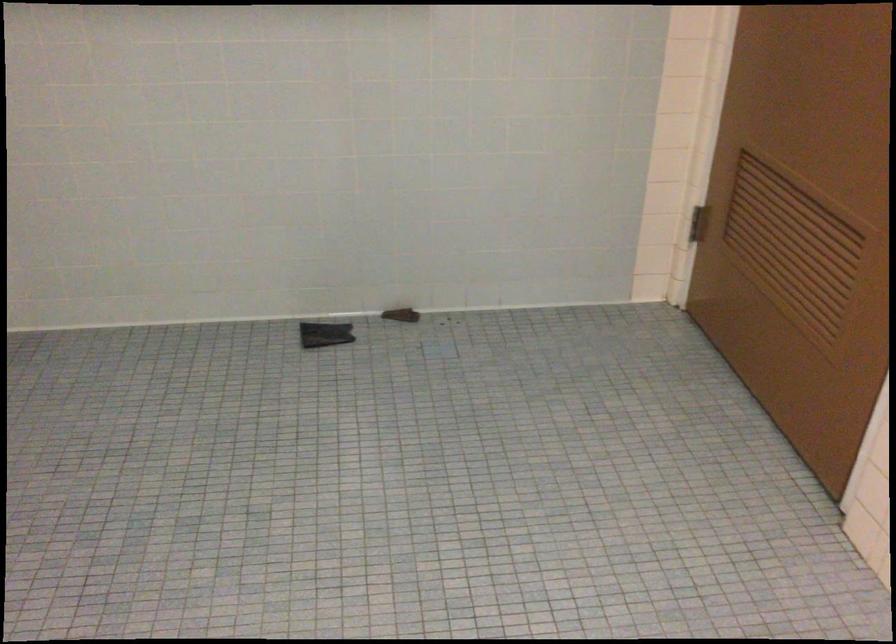
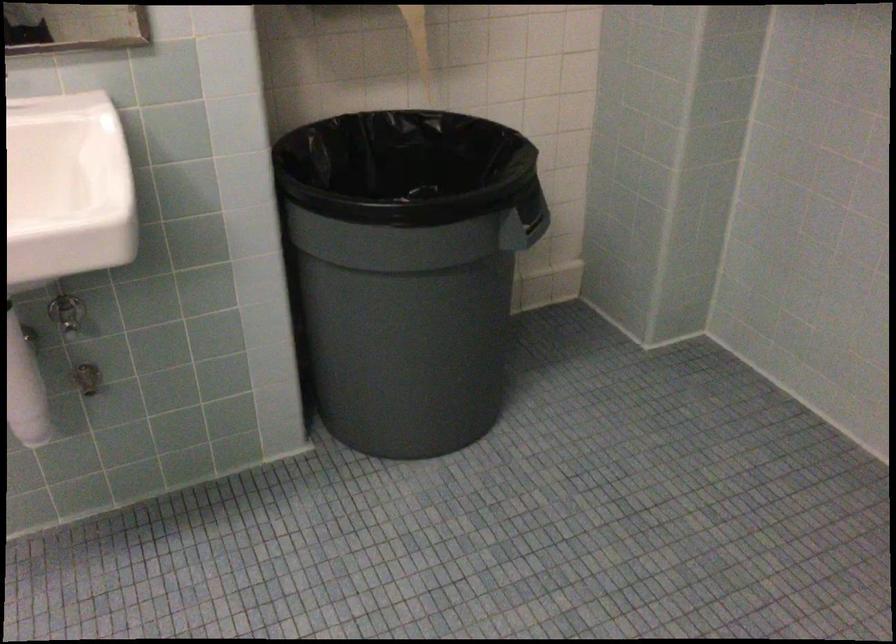
Locate, in the second image, the point that corresponds to (154,391) in the first image.

(745, 469)